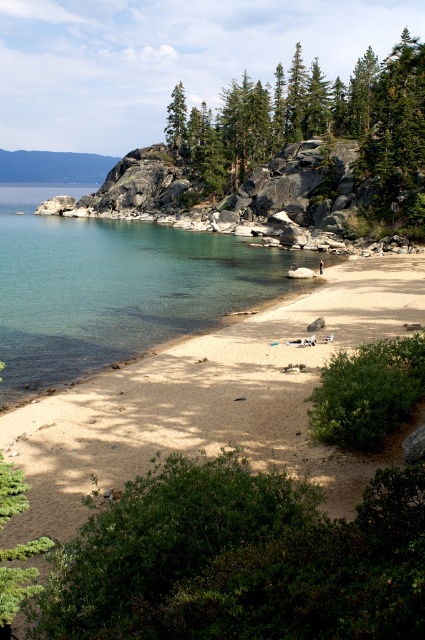
Question: Which point is farther from the camera taking this photo?

Choices:
 (A) (320, 262)
 (B) (357, 278)

Answer: (A)

Question: Can you confirm if clear glass water at center is positioned to the left of light blue denim shorts at center?

Choices:
 (A) yes
 (B) no

Answer: (A)

Question: Which point appears farthest from the camera in this image?

Choices:
 (A) (419, 180)
 (B) (322, 264)
 (C) (74, 481)

Answer: (A)

Question: Does clear glass water at center appear over light blue denim shorts at center?

Choices:
 (A) yes
 (B) no

Answer: (A)

Question: Can you confirm if light brown sand at center is bigger than light blue denim shorts at center?

Choices:
 (A) yes
 (B) no

Answer: (A)

Question: Which point appears closest to the camera in this image?

Choices:
 (A) (101, 264)
 (B) (370, 120)
 (C) (319, 273)
 (D) (142, 468)

Answer: (D)